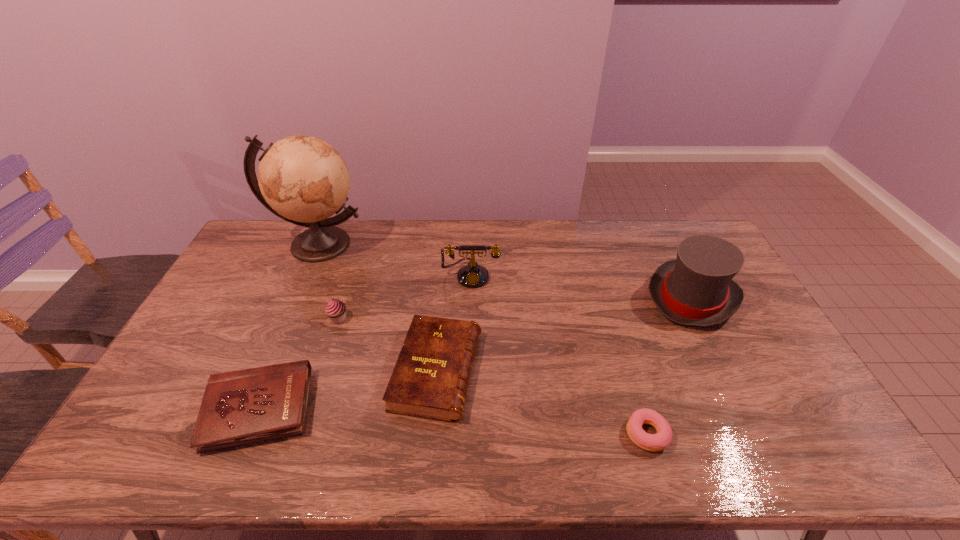
I want to click on vacant area situated 0.400m on the left of the sixth shortest object, so (x=525, y=297).

Locate an element on the screen. This screenshot has width=960, height=540. free point located 0.380m on the dial of the third tallest object is located at coordinates (468, 384).

This screenshot has height=540, width=960. What are the coordinates of `free space located on the right of the fourth shortest object` in the screenshot? It's located at (405, 319).

Locate an element on the screen. This screenshot has height=540, width=960. vacant space situated on the left of the right hardback book is located at coordinates (300, 371).

Image resolution: width=960 pixels, height=540 pixels. Identify the location of free point located on the right of the left hardback book. (345, 410).

The image size is (960, 540). I want to click on blank space located on the left of the sixth object from left to right, so click(x=606, y=434).

You are a GUI agent. You are given a task and a screenshot of the screen. Output one action in this format:
    pyautogui.click(x=<x>, y=<y>)
    Task: Click on the object present at the far edge
    
    Given the screenshot: What is the action you would take?
    pyautogui.click(x=303, y=180)

In order to click on hardback book located in the near edge section of the desktop in this screenshot , I will do `click(246, 406)`.

The width and height of the screenshot is (960, 540). In order to click on doughnut that is at the near edge in this screenshot , I will do `click(651, 442)`.

At what (x,y) coordinates should I click in order to perform the action: click on object located in the left edge section of the desktop. Please return your answer as a coordinate pair (x, y). The image size is (960, 540). Looking at the image, I should click on (303, 180).